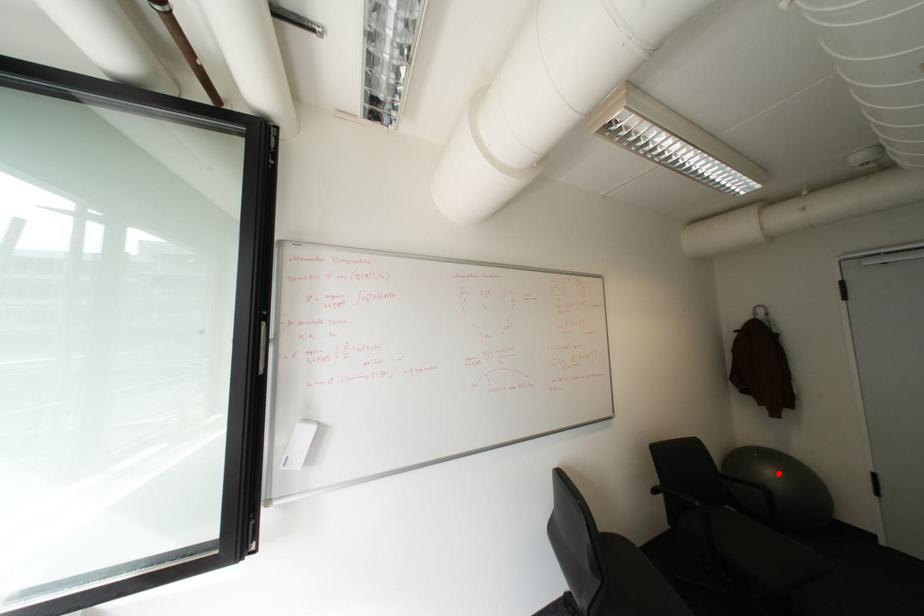
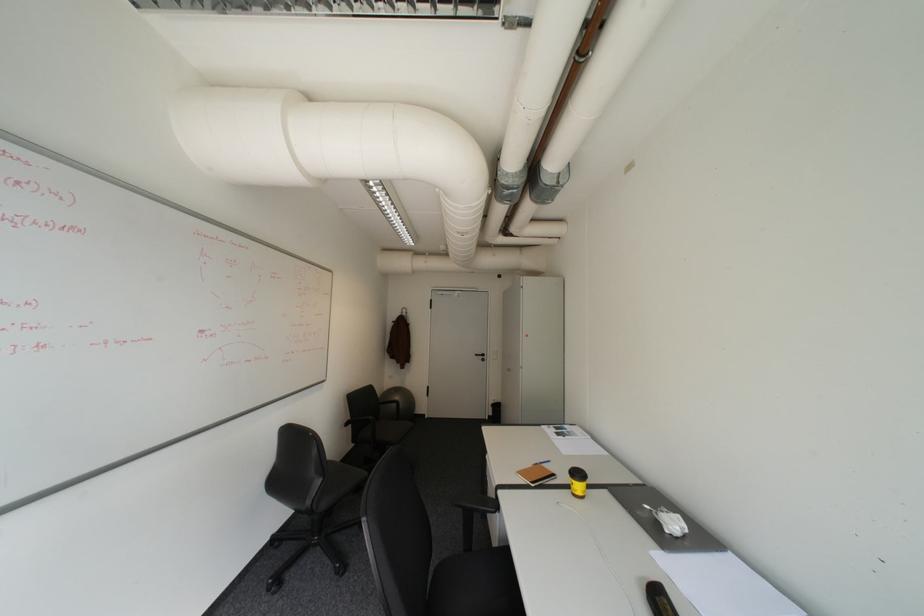
Question: A red point is marked in image1. In image2, is the corresponding 3D point closer to the camera or farther? Reply with the corresponding letter.

Choices:
 (A) The corresponding 3D point is closer.
 (B) The corresponding 3D point is farther.

Answer: (B)